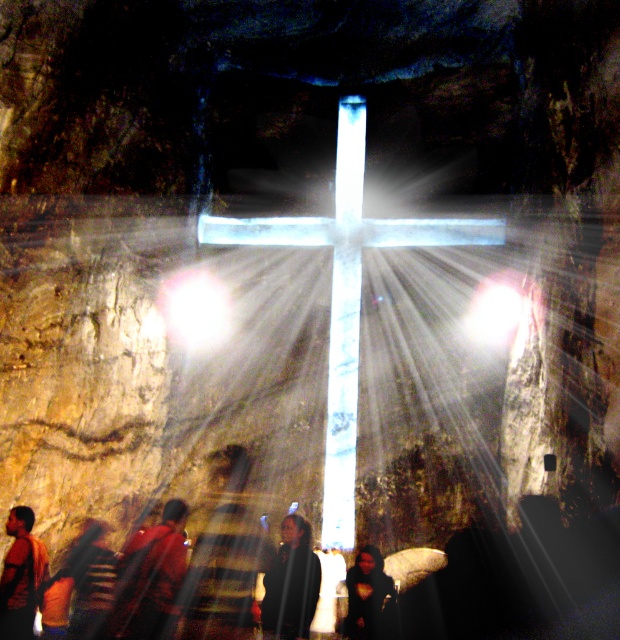
Does illuminated glass cross at center have a larger size compared to dark brown leather jacket at lower left?

Yes, illuminated glass cross at center is bigger than dark brown leather jacket at lower left.

Which is in front, point (342, 337) or point (2, 630)?

Positioned in front is point (2, 630).

Image resolution: width=620 pixels, height=640 pixels. Find the location of `illuminated glass cross at center`. illuminated glass cross at center is located at coordinates (347, 292).

Does point (241, 484) lie behind point (169, 588)?

That is True.

The image size is (620, 640). I want to click on striped fabric shirt at lower center, so click(224, 556).

How far apart are bright white light at center and dark brown leather jacket at lower left?

The distance of bright white light at center from dark brown leather jacket at lower left is 11.03 feet.

Measure the distance between point (195, 320) and camera.

A distance of 8.76 meters exists between point (195, 320) and camera.

Where is `bright white light at center`? bright white light at center is located at coordinates (195, 308).